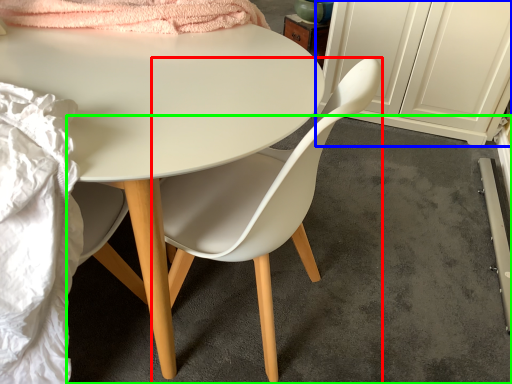
Question: Which is nearer to the chair (highlighted by a red box)? cabinetry (highlighted by a blue box) or concrete (highlighted by a green box).

Choices:
 (A) cabinetry
 (B) concrete

Answer: (B)